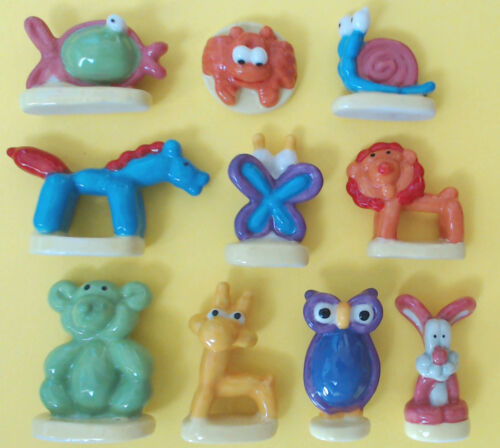
Find the location of a particular element. Image resolution: width=500 pixels, height=448 pixels. sculpture base is located at coordinates (82, 98), (251, 108), (378, 106), (430, 249), (256, 255), (112, 249), (103, 433), (241, 433), (345, 432), (431, 432).